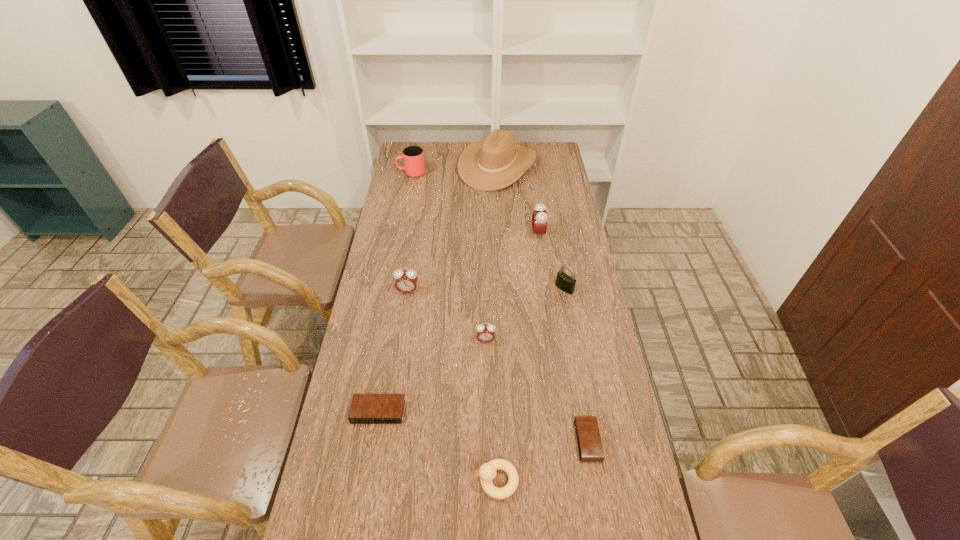
In order to click on empty space that is in between the fourth tallest alarm clock and the cowboy hat in this screenshot , I will do `click(438, 289)`.

What are the coordinates of `vacant space in between the rightmost pink alarm clock and the duckling` in the screenshot? It's located at (517, 357).

Find the location of a particular element. empty space between the black padlock and the fourth nearest object is located at coordinates (525, 314).

Where is `vacant area that lies between the seventh nearest object and the third tallest alarm clock`? vacant area that lies between the seventh nearest object and the third tallest alarm clock is located at coordinates (512, 287).

Where is `object that is the third closest to the eighth tallest object`? The image size is (960, 540). object that is the third closest to the eighth tallest object is located at coordinates (406, 281).

Identify which object is the second nearest to the leftmost pink alarm clock. Please provide its 2D coordinates. Your answer should be formatted as a tuple, i.e. [(x, y)], where the tuple contains the x and y coordinates of a point satisfying the conditions above.

[(365, 408)]

I want to click on alarm clock that can be found as the closest to the cup, so click(x=539, y=216).

Choose which alarm clock is the second nearest neighbor to the second shortest alarm clock. Please provide its 2D coordinates. Your answer should be formatted as a tuple, i.e. [(x, y)], where the tuple contains the x and y coordinates of a point satisfying the conditions above.

[(406, 281)]

Find the location of a particular element. The width and height of the screenshot is (960, 540). pink alarm clock that is the third closest one to the cowboy hat is located at coordinates (485, 333).

Identify which pink alarm clock is located as the second nearest to the second alarm clock from right to left. Please provide its 2D coordinates. Your answer should be formatted as a tuple, i.e. [(x, y)], where the tuple contains the x and y coordinates of a point satisfying the conditions above.

[(406, 281)]